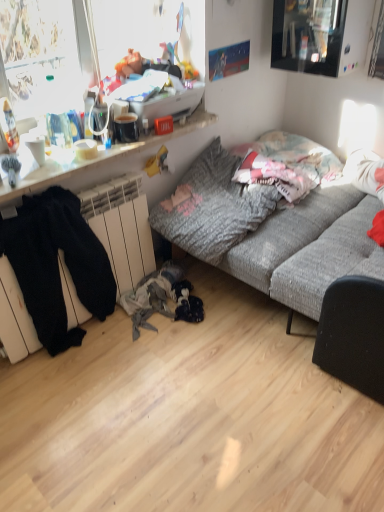
At what (x,y) coordinates should I click in order to perform the action: click on vacant space in front of black cotton pants at lower left. Please return your answer as a coordinate pair (x, y). Image resolution: width=384 pixels, height=512 pixels. Looking at the image, I should click on (57, 402).